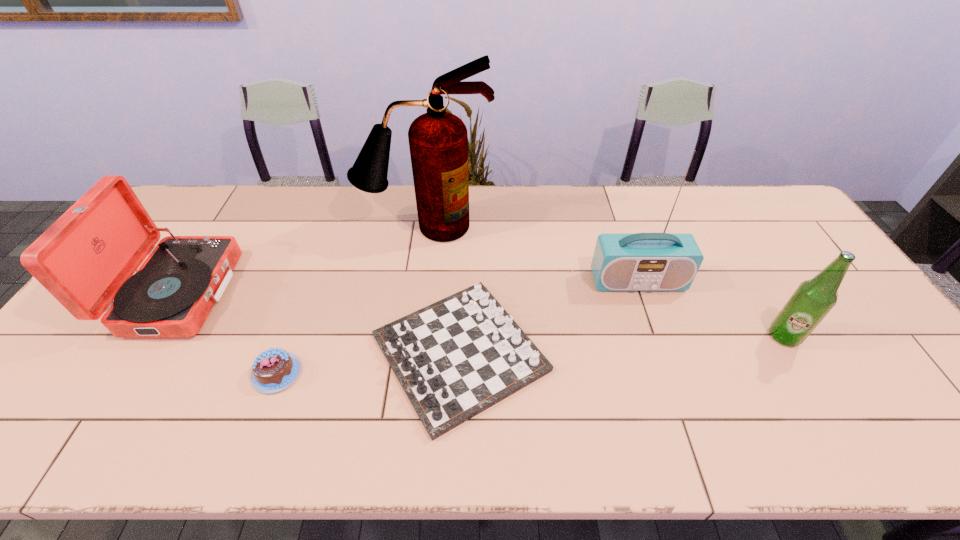
Locate an element on the screen. free space located 0.120m on the front panel of the fifth shortest object is located at coordinates (654, 329).

What are the coordinates of `vacant area located 0.130m on the front-facing side of the phonograph_record` in the screenshot? It's located at (275, 293).

Where is `vacant space situated 0.190m on the label of the beer bottle`? vacant space situated 0.190m on the label of the beer bottle is located at coordinates (832, 420).

I want to click on free spot located on the right of the chessboard, so click(x=610, y=353).

I want to click on vacant area situated 0.320m on the right of the shortest object, so click(x=432, y=373).

You are a GUI agent. You are given a task and a screenshot of the screen. Output one action in this format:
    pyautogui.click(x=<x>, y=<y>)
    Task: Click on the object that is at the far edge
    Image resolution: width=960 pixels, height=540 pixels.
    Given the screenshot: What is the action you would take?
    (438, 140)

This screenshot has width=960, height=540. Identify the location of object that is at the near edge. (457, 357).

This screenshot has width=960, height=540. What are the coordinates of `object positioned at the left edge` in the screenshot? It's located at (85, 259).

In the image, there is a desktop. Identify the location of vacant region at the far edge. This screenshot has height=540, width=960. (498, 226).

The image size is (960, 540). What are the coordinates of `blank area at the near edge` in the screenshot? It's located at (774, 441).